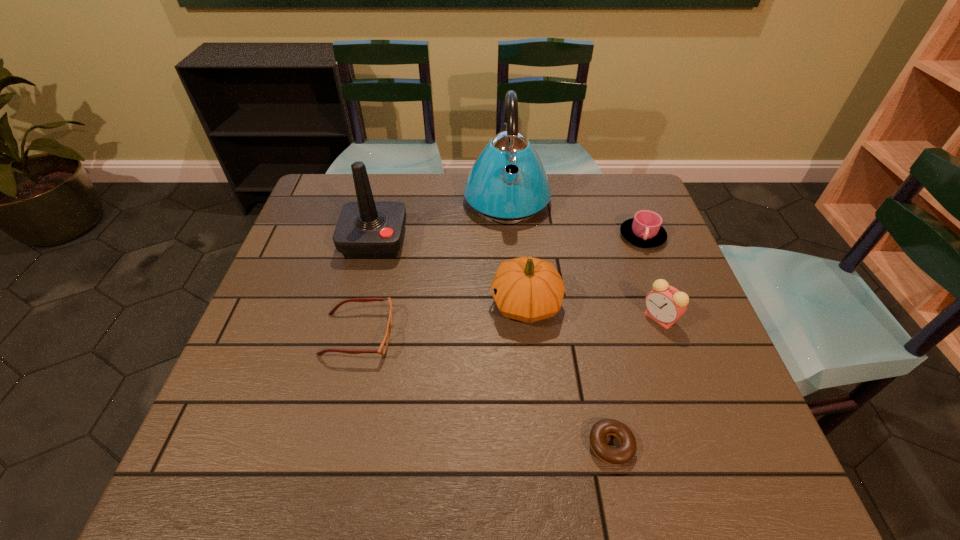
Identify the location of free point located 0.140m on the side of the third tallest object with the carved face. (432, 303).

Find the location of a particular element. The width and height of the screenshot is (960, 540). vacant space located on the side of the third tallest object with the carved face is located at coordinates (403, 303).

Where is `free space located 0.100m on the side of the third tallest object with the carved face`? The height and width of the screenshot is (540, 960). free space located 0.100m on the side of the third tallest object with the carved face is located at coordinates (448, 303).

This screenshot has width=960, height=540. In order to click on free space located 0.220m on the face of the alarm clock in this screenshot , I will do `click(550, 318)`.

The width and height of the screenshot is (960, 540). Identify the location of free space located 0.180m on the face of the alarm clock. (566, 318).

Find the location of a particular element. free space located 0.240m on the face of the alarm clock is located at coordinates coord(541,318).

Find the location of a particular element. The width and height of the screenshot is (960, 540). free space located 0.370m on the side with the handle of the cup is located at coordinates (693, 368).

Find the location of a particular element. free point located on the front-facing side of the second shortest object is located at coordinates (467, 335).

Identify the location of free spot located 0.210m on the right of the doughnut. The image size is (960, 540). (744, 446).

Identify the location of object present at the far edge. Image resolution: width=960 pixels, height=540 pixels. (494, 194).